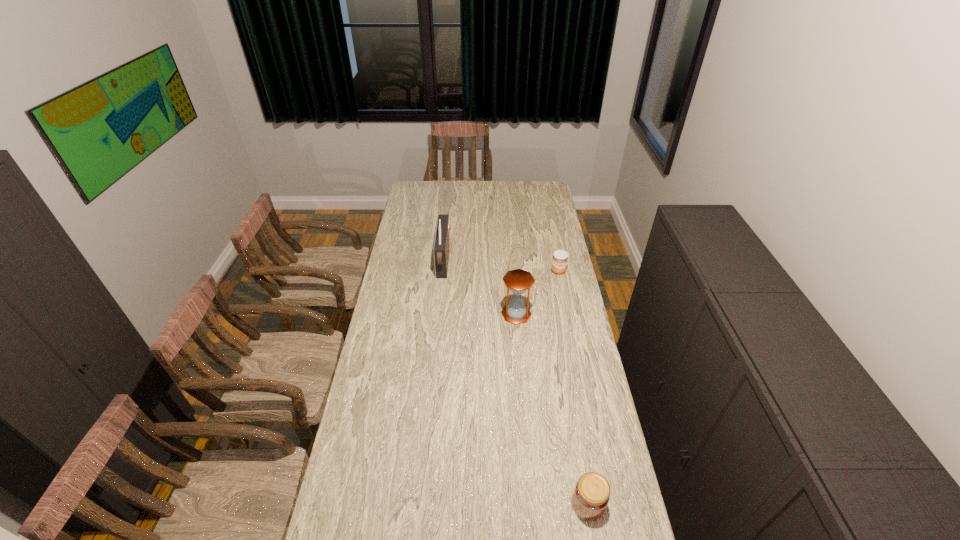
In the image, there is a desktop. At what (x,y) coordinates should I click in order to perform the action: click on vacant space at the left edge. Please return your answer as a coordinate pair (x, y). Image resolution: width=960 pixels, height=540 pixels. Looking at the image, I should click on (407, 322).

In the image, there is a desktop. Identify the location of vacant space at the right edge. The height and width of the screenshot is (540, 960). (574, 430).

Find the location of a particular element. The height and width of the screenshot is (540, 960). free space between the tallest object and the nearer jam is located at coordinates (516, 383).

Where is `free space between the second object from left to right and the radio receiver`? The height and width of the screenshot is (540, 960). free space between the second object from left to right and the radio receiver is located at coordinates (480, 288).

This screenshot has width=960, height=540. I want to click on vacant area between the radio receiver and the hourglass, so click(x=480, y=288).

The height and width of the screenshot is (540, 960). I want to click on vacant point located between the farther jam and the tallest object, so click(x=501, y=266).

At what (x,y) coordinates should I click in order to perform the action: click on empty location between the radio receiver and the nearer jam. Please return your answer as a coordinate pair (x, y). Looking at the image, I should click on (516, 383).

This screenshot has height=540, width=960. Identify the location of vacant area that lies between the nearer jam and the third shortest object. (552, 409).

Where is `free spot between the nearest object and the second nearest object`? This screenshot has height=540, width=960. free spot between the nearest object and the second nearest object is located at coordinates (552, 409).

This screenshot has width=960, height=540. I want to click on vacant space that is in between the radio receiver and the nearer jam, so click(x=516, y=383).